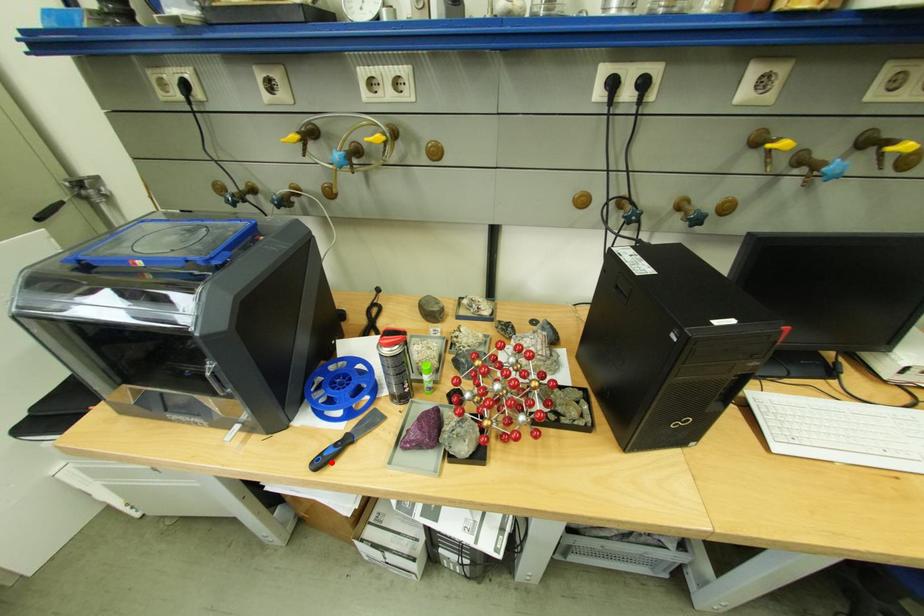
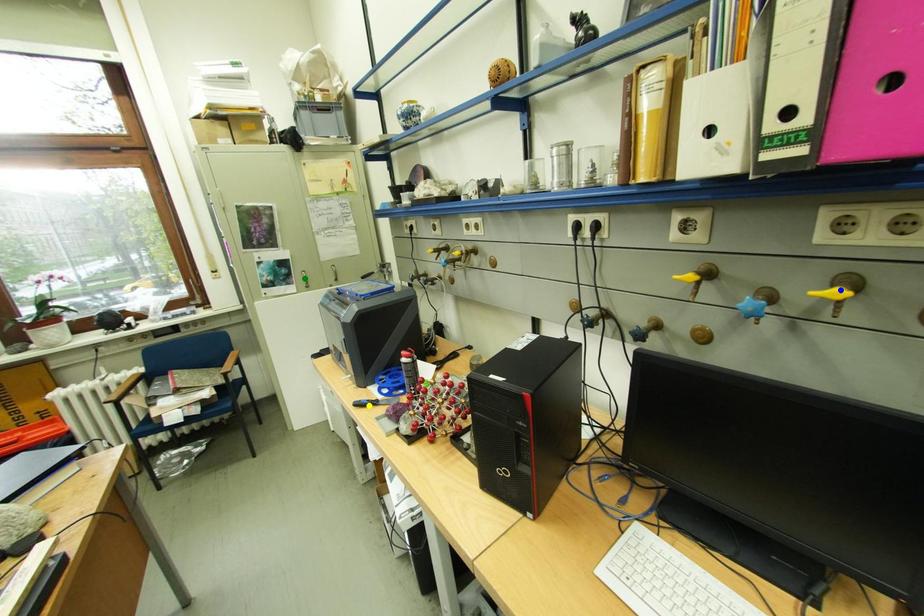
Question: I am providing you with two images of the same scene from different viewpoints. A red point is marked on the first image. You are given multiple points on the second image. Which spot in image 2 lines up with the point in image 1?

Choices:
 (A) blue point
 (B) yellow point
 (C) green point

Answer: (B)